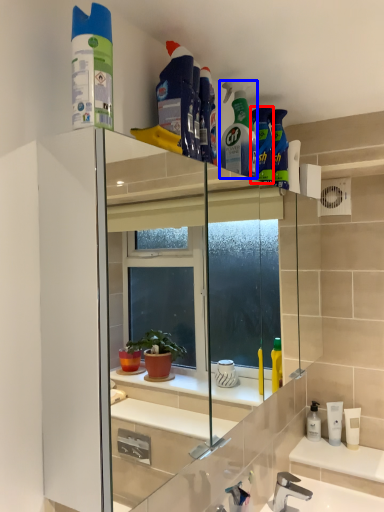
Question: Which point is further to the camera, cleaning product (highlighted by a red box) or cleaning product (highlighted by a blue box)?

Choices:
 (A) cleaning product
 (B) cleaning product

Answer: (A)